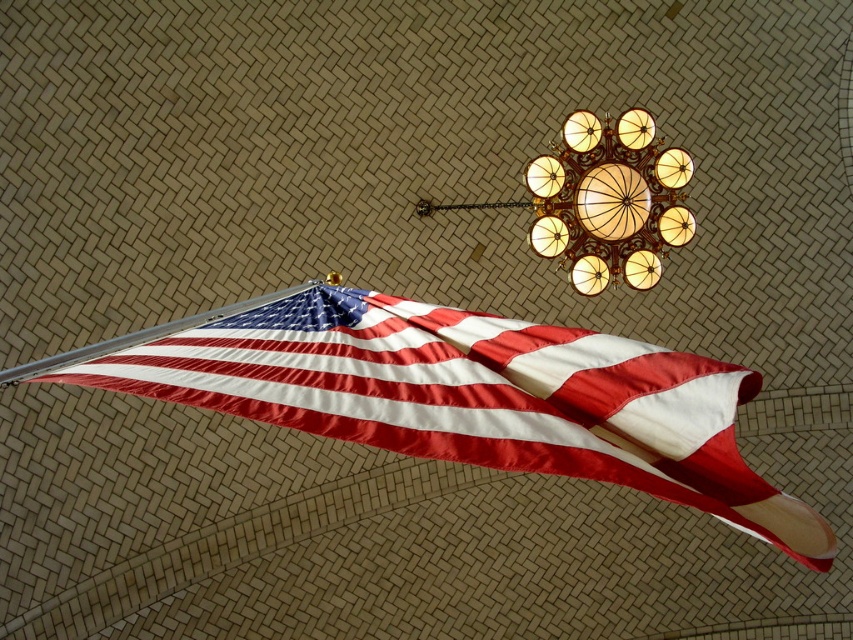
Where is `matte gold chandelier at upper center`? This screenshot has width=853, height=640. matte gold chandelier at upper center is located at coordinates (608, 200).

Can you confirm if matte gold chandelier at upper center is positioned above silky fabric flag pole at lower left?

Yes.

Where is `matte gold chandelier at upper center`? Image resolution: width=853 pixels, height=640 pixels. matte gold chandelier at upper center is located at coordinates (608, 200).

Between silky fabric flag at lower left and matte gold chandelier at upper center, which one is positioned lower?

Positioned lower is silky fabric flag at lower left.

Does silky fabric flag at lower left have a larger size compared to matte gold chandelier at upper center?

No.

The width and height of the screenshot is (853, 640). I want to click on silky fabric flag at lower left, so click(x=476, y=397).

You are a GUI agent. You are given a task and a screenshot of the screen. Output one action in this format:
    pyautogui.click(x=<x>, y=<y>)
    Task: Click on the silky fabric flag at lower left
    
    Given the screenshot: What is the action you would take?
    pyautogui.click(x=476, y=397)

Is silky fabric flag at lower left taller than silky fabric flag pole at lower left?

No.

Who is higher up, silky fabric flag at lower left or silky fabric flag pole at lower left?

silky fabric flag pole at lower left is higher up.

Locate an element on the screen. silky fabric flag at lower left is located at coordinates (476, 397).

Find the location of `silky fabric flag at lower left`. silky fabric flag at lower left is located at coordinates (476, 397).